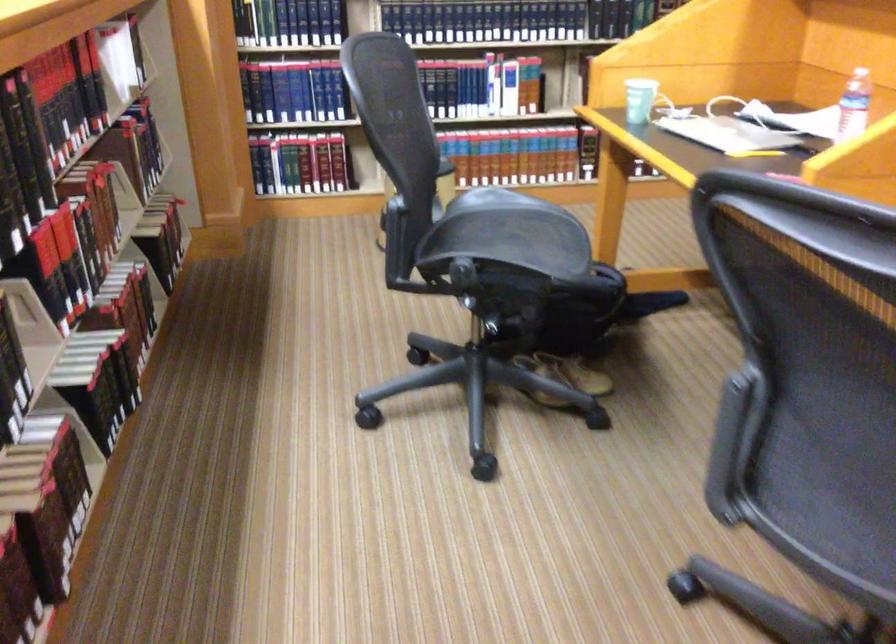
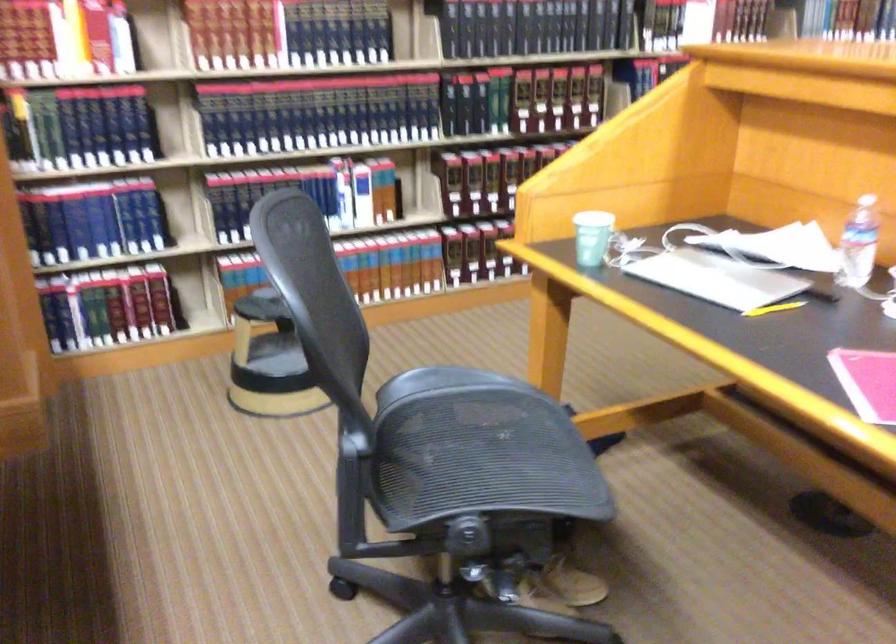
The point at (501, 234) is marked in the first image. Where is the corresponding point in the second image?

(470, 442)